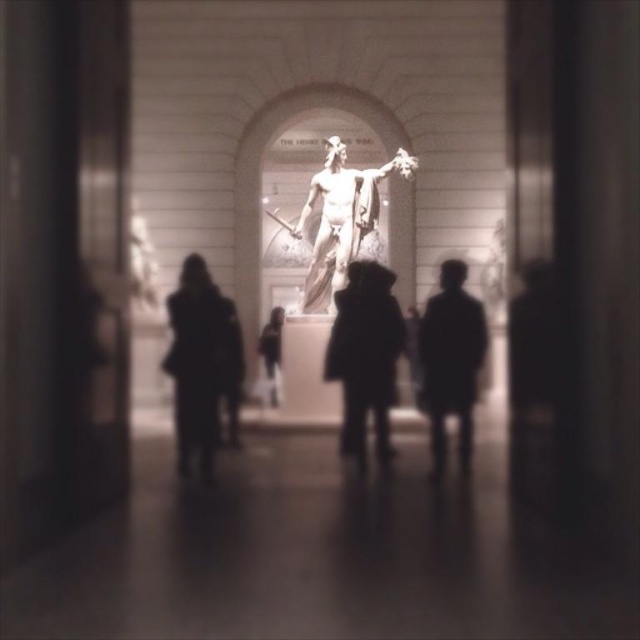
You are standing in the museum and want to take a photo of the statue. The camera you are using has a maximum focus range of 250 feet. Is the point at coordinates point (456,304) within the camera focus range?

The distance of point (456,304) from the camera is 257.36 feet, which exceeds the camera maximum focus range of 250 feet. The camera cannot focus on that point.

You are standing in the museum and want to touch the dark wool coat at center. Considering the distance, is it possible for you to reach it without moving closer?

The dark wool coat at center is 73.79 meters away from the viewer, which is too far to reach without moving closer. You need to approach it to touch it.

You are a security guard in the museum and need to determine which coat is more likely to block the view of the statue for visitors standing behind it. Based on their sizes, which coat among the dark matte coat at center and dark fabric coat at center would be the better choice to avoid blocking the view?

The dark matte coat at center is larger in size than the dark fabric coat at center, so the dark matte coat at center would be more likely to block the view. To avoid blocking the view, the smaller dark fabric coat at center should be chosen.